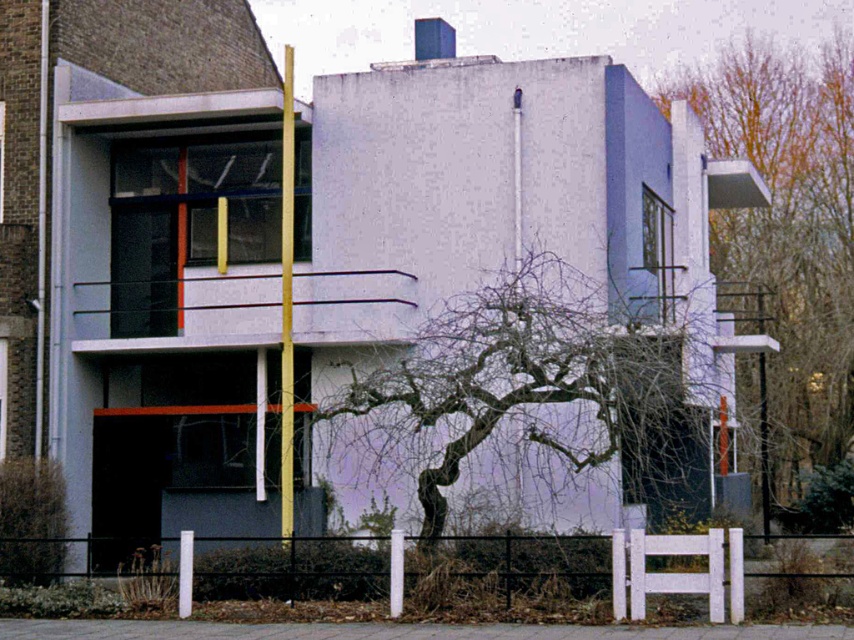
You are standing in front of the modernist building and want to take a photo of the bare branches at center and the white painted wood fence at lower center. Which object will appear larger in the photo?

The bare branches at center will appear larger in the photo because it is closer to the viewer than the white painted wood fence at lower center.

You are standing in front of the modernist building and want to take a photo of the golden pole. Where should you position yourself to ensure the bare branches at center are not blocking the view?

To avoid the bare branches at center blocking the view of the golden pole, position yourself such that the golden pole is not at point (534, 387), which is where the bare branches are located.

You are an architect analyzing the modernist building. You notice two sets of bare branches in the image. Which set, the bare branches at center or the bare branches at upper right, is shorter in height?

The bare branches at center is not as tall as bare branches at upper right, so the bare branches at center is shorter in height.